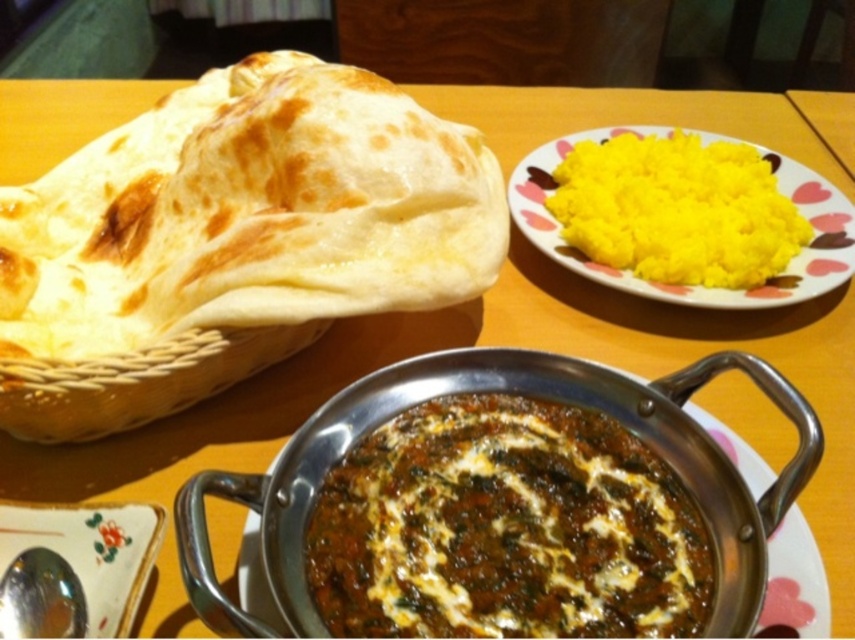
You are sitting at the wooden table and want to reach both points. Which point, point (546, 465) or point (740, 195), is closer to you?

Point (546, 465) is closer to the viewer than point (740, 195), so you can reach it first.

You are a food delivery person who needs to place a hot pad between the golden brown dough at left and the brown matte curry at center. The hot pad is 8 inches in diameter. Will it fit without overlapping either item?

The golden brown dough at left is 9.28 inches from the brown matte curry at center. Since the hot pad is 8 inches in diameter, it will fit between them without overlapping as there is enough space.